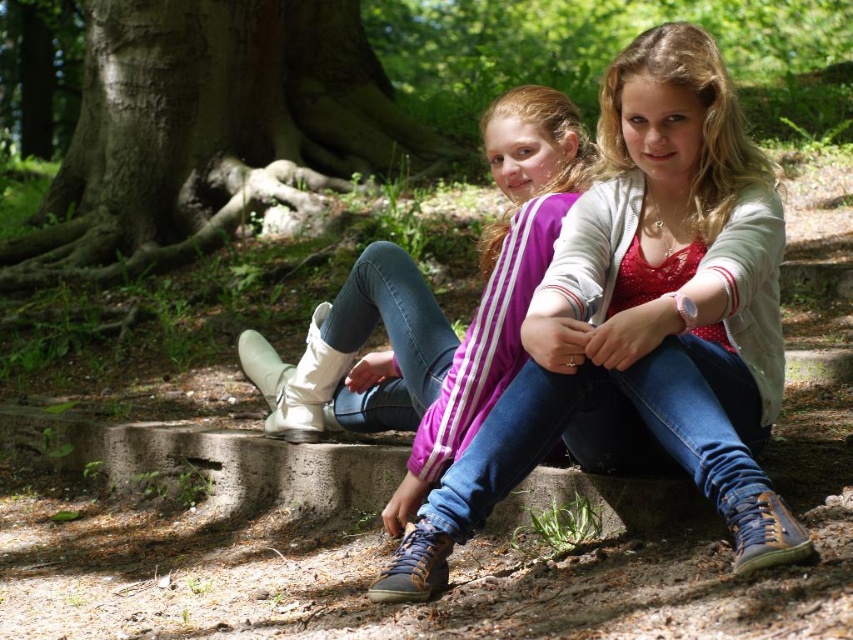
Question: Is smooth brown tree trunk at center wider than matte white boots at center?

Choices:
 (A) yes
 (B) no

Answer: (A)

Question: Which of the following is the farthest from the observer?

Choices:
 (A) (695, 86)
 (B) (218, 184)

Answer: (B)

Question: Which point is farther to the camera?

Choices:
 (A) matte white boots at center
 (B) denim jeans at center

Answer: (A)

Question: Does denim jeans at center appear on the right side of smooth brown tree trunk at center?

Choices:
 (A) yes
 (B) no

Answer: (A)

Question: Which object is closer to the camera taking this photo?

Choices:
 (A) smooth brown tree trunk at center
 (B) matte white boots at center

Answer: (B)

Question: Is smooth brown tree trunk at center in front of matte white boots at center?

Choices:
 (A) yes
 (B) no

Answer: (B)